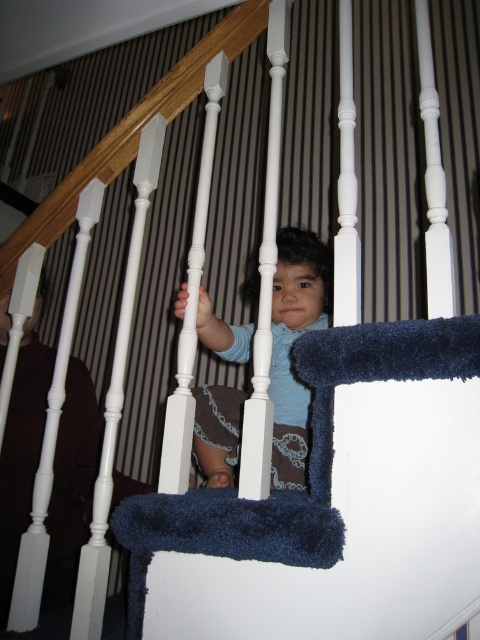
Question: Considering the relative positions of blue plush stair at center and matte blue shirt at center in the image provided, where is blue plush stair at center located with respect to matte blue shirt at center?

Choices:
 (A) left
 (B) right

Answer: (B)

Question: Which object appears closest to the camera in this image?

Choices:
 (A) matte blue shirt at center
 (B) blue plush stair at center

Answer: (B)

Question: Can you confirm if blue plush stair at center is wider than matte blue shirt at center?

Choices:
 (A) no
 (B) yes

Answer: (B)

Question: Observing the image, what is the correct spatial positioning of blue plush stair at center in reference to matte blue shirt at center?

Choices:
 (A) above
 (B) below

Answer: (B)